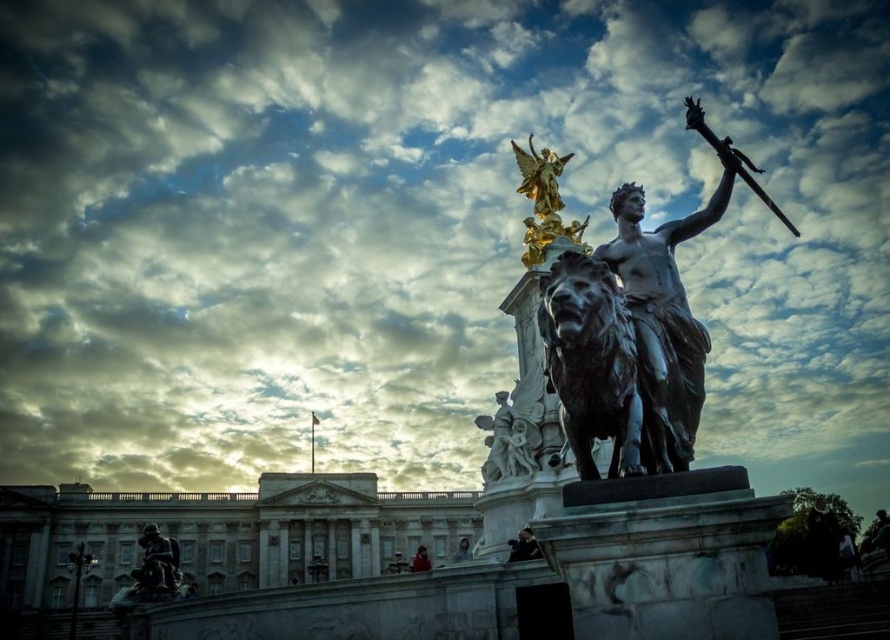
Question: Can you confirm if bronze statue at center is positioned to the left of gold polished statue at upper center?

Choices:
 (A) no
 (B) yes

Answer: (B)

Question: Which object appears closest to the camera in this image?

Choices:
 (A) bronze statue at lower left
 (B) polished bronze statue at center
 (C) bronze statue at center

Answer: (C)

Question: Is bronze statue at center further to the viewer compared to gold polished statue at upper center?

Choices:
 (A) yes
 (B) no

Answer: (B)

Question: Which point is farther to the camera?

Choices:
 (A) bronze statue at lower left
 (B) polished bronze statue at center

Answer: (A)

Question: Which is farther from the gold polished statue at upper center?

Choices:
 (A) bronze statue at center
 (B) polished bronze statue at center
 (C) bronze statue at lower left

Answer: (C)

Question: Can you confirm if gold polished statue at upper center is thinner than bronze statue at lower left?

Choices:
 (A) no
 (B) yes

Answer: (B)